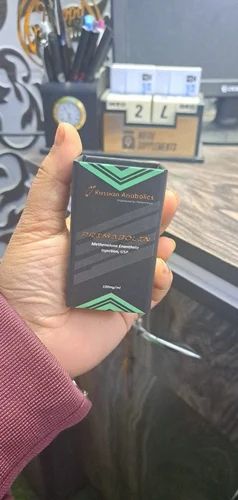
In order to click on stainless steel draw handle in this screenshot , I will do `click(153, 338)`.